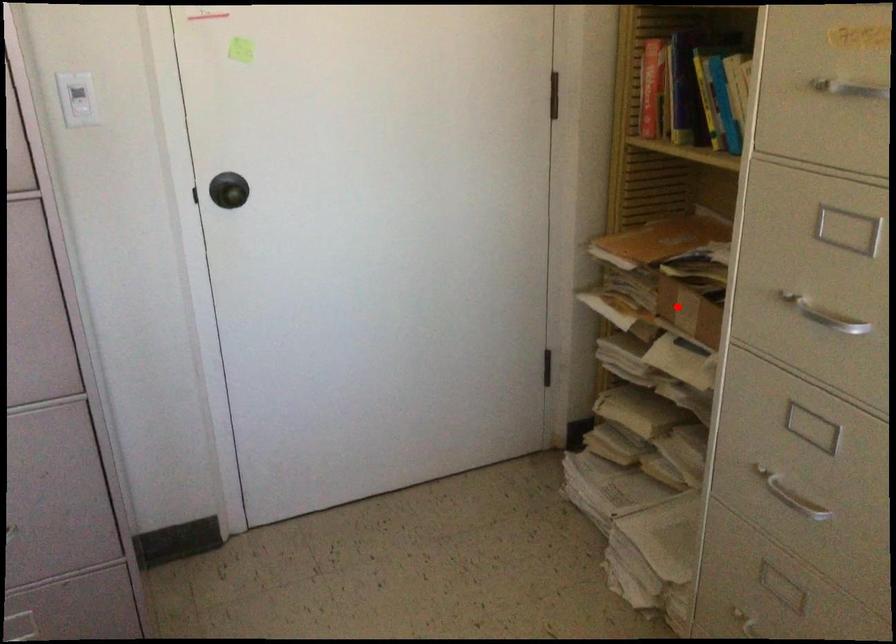
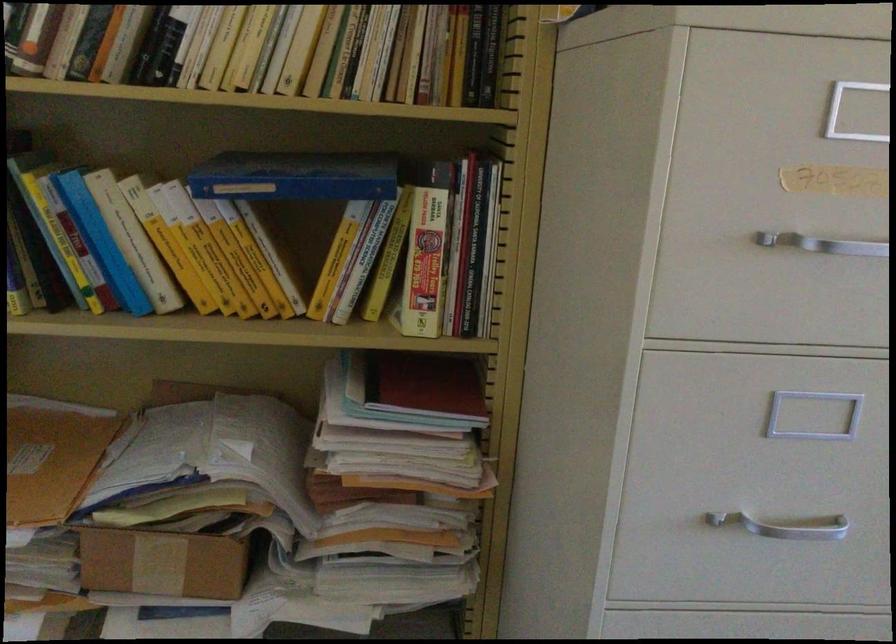
In the second image, find the point that corresponds to the highlighted location in the first image.

(161, 564)